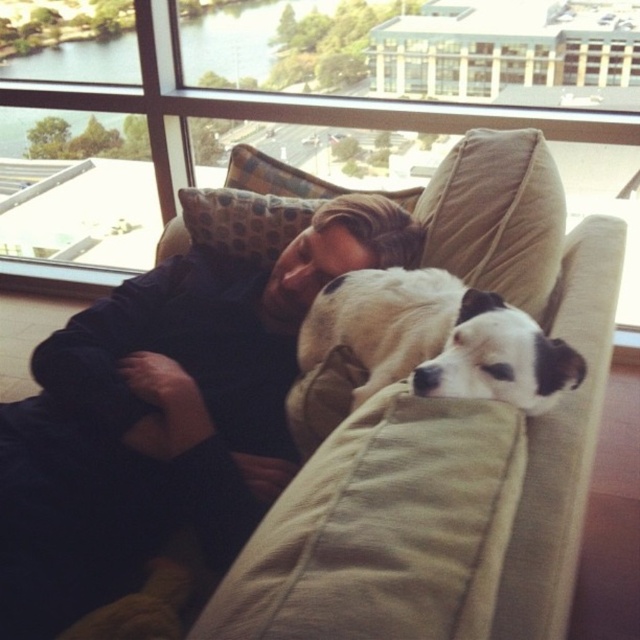
Question: Is transparent glass window at upper center thinner than black soft shirt at center?

Choices:
 (A) yes
 (B) no

Answer: (B)

Question: Which object is the closest to the beige fabric couch at center?

Choices:
 (A) white-furred dog at center
 (B) black soft shirt at center

Answer: (A)

Question: Does beige fabric couch at center have a lesser width compared to black soft shirt at center?

Choices:
 (A) yes
 (B) no

Answer: (A)

Question: Which object is farther from the camera taking this photo?

Choices:
 (A) transparent glass window at upper center
 (B) white-furred dog at center

Answer: (A)

Question: Is transparent glass window at upper center thinner than white-furred dog at center?

Choices:
 (A) yes
 (B) no

Answer: (B)

Question: Which object appears farthest from the camera in this image?

Choices:
 (A) beige fabric couch at center
 (B) black soft shirt at center
 (C) transparent glass window at upper center

Answer: (C)